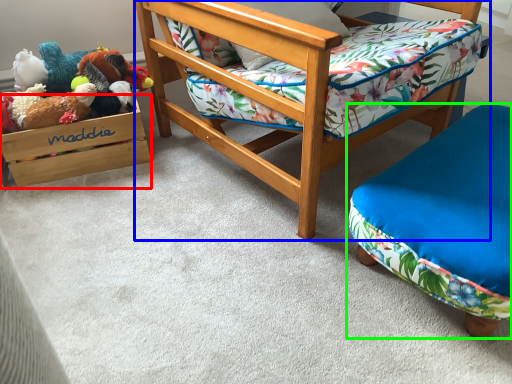
Question: Which object is the closest to the storage box (highlighted by a red box)? Choose among these: chair (highlighted by a blue box) or furniture (highlighted by a green box).

Choices:
 (A) chair
 (B) furniture

Answer: (A)